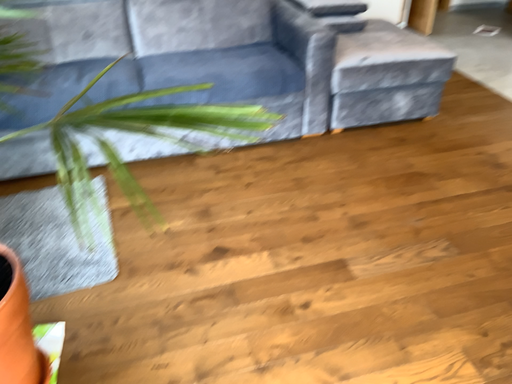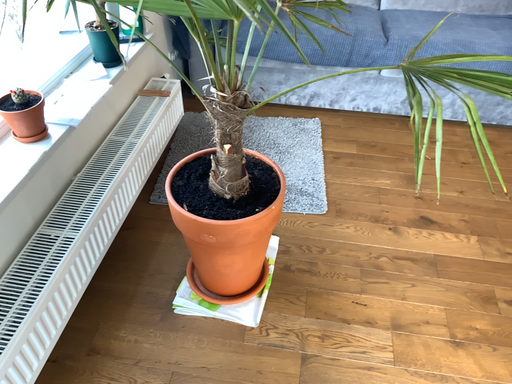
Question: How did the camera likely rotate when shooting the video?

Choices:
 (A) rotated right
 (B) rotated left

Answer: (B)